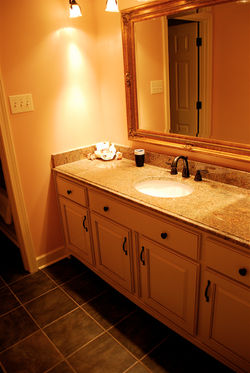
Find where you'd grab to open a door in the image. Your answer should be formatted as a list of tuples, i.e. [(x1, y1), (x2, y2), ...], where each tuple contains the x and y coordinates of a point satisfying the conditions above.

[(66, 191), (83, 223), (103, 209), (124, 241), (162, 235), (140, 258), (207, 287), (242, 272)]